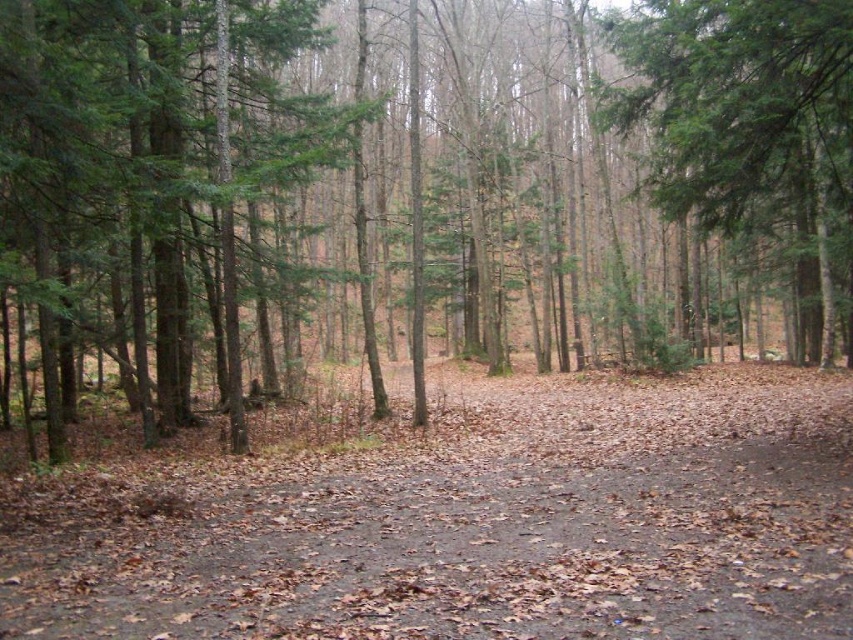
Question: Which object appears closest to the camera in this image?

Choices:
 (A) green matte tree at center
 (B) green matte tree at upper right

Answer: (A)

Question: Does green matte tree at center have a larger size compared to brown dirt trail at center?

Choices:
 (A) yes
 (B) no

Answer: (A)

Question: Which object is closer to the camera taking this photo?

Choices:
 (A) green matte tree at center
 (B) brown dirt trail at center
 (C) green matte tree at upper right

Answer: (B)

Question: Does green matte tree at center appear on the right side of green matte tree at upper right?

Choices:
 (A) yes
 (B) no

Answer: (B)

Question: Which point is closer to the camera?

Choices:
 (A) (851, 65)
 (B) (97, 564)
 (C) (120, 204)

Answer: (B)

Question: Does brown dirt trail at center appear over green matte tree at upper right?

Choices:
 (A) no
 (B) yes

Answer: (A)